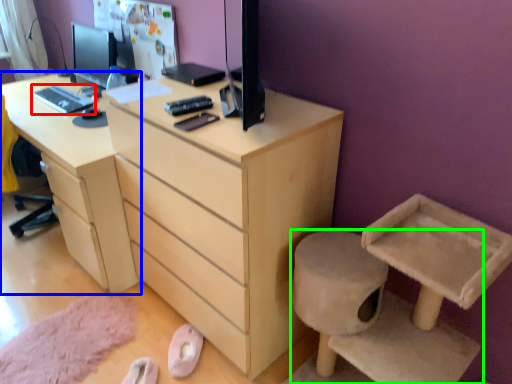
Question: Which object is positioned farthest from desktop (highlighted by a red box)? Select from desk (highlighted by a blue box) and furniture (highlighted by a green box).

Choices:
 (A) desk
 (B) furniture

Answer: (B)